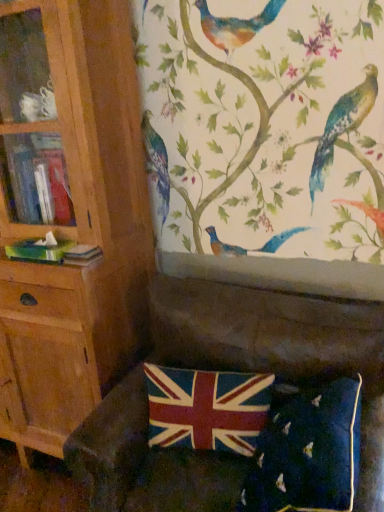
Question: Are velvet union jack at lower center and wooden bookcase at left beside each other?

Choices:
 (A) no
 (B) yes

Answer: (A)

Question: Is velvet union jack at lower center positioned behind wooden bookcase at left?

Choices:
 (A) yes
 (B) no

Answer: (A)

Question: Is velvet union jack at lower center facing towards wooden bookcase at left?

Choices:
 (A) no
 (B) yes

Answer: (A)

Question: Considering the relative sizes of velvet union jack at lower center and wooden bookcase at left in the image provided, is velvet union jack at lower center wider than wooden bookcase at left?

Choices:
 (A) yes
 (B) no

Answer: (B)

Question: Is velvet union jack at lower center thinner than wooden bookcase at left?

Choices:
 (A) no
 (B) yes

Answer: (B)

Question: Considering the relative sizes of velvet union jack at lower center and wooden bookcase at left in the image provided, is velvet union jack at lower center taller than wooden bookcase at left?

Choices:
 (A) no
 (B) yes

Answer: (A)

Question: Does velvet dark green couch at lower center have a larger size compared to velvet union jack pillow at lower center?

Choices:
 (A) yes
 (B) no

Answer: (A)

Question: Is velvet dark green couch at lower center wider than velvet union jack pillow at lower center?

Choices:
 (A) no
 (B) yes

Answer: (B)

Question: From the image's perspective, is velvet dark green couch at lower center above velvet union jack pillow at lower center?

Choices:
 (A) yes
 (B) no

Answer: (B)

Question: Is the depth of velvet dark green couch at lower center less than that of velvet union jack pillow at lower center?

Choices:
 (A) yes
 (B) no

Answer: (A)

Question: Would you say velvet dark green couch at lower center is a long distance from velvet union jack pillow at lower center?

Choices:
 (A) yes
 (B) no

Answer: (B)

Question: Is velvet dark green couch at lower center placed right next to velvet union jack pillow at lower center?

Choices:
 (A) yes
 (B) no

Answer: (B)

Question: Does velvet dark green couch at lower center lie behind wooden bookcase at left?

Choices:
 (A) yes
 (B) no

Answer: (B)